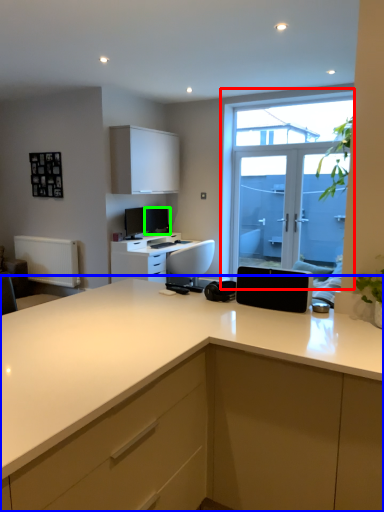
Question: Considering the real-world distances, which object is closest to window (highlighted by a red box)? countertop (highlighted by a blue box) or computer monitor (highlighted by a green box).

Choices:
 (A) countertop
 (B) computer monitor

Answer: (B)